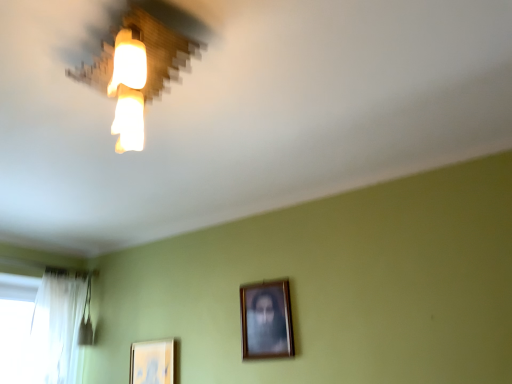
Question: Is wooden framed portrait at center, the 1th picture frame when ordered from right to left, in front of or behind matte white picture frame at lower left, arranged as the second picture frame when viewed from the right, in the image?

Choices:
 (A) behind
 (B) front

Answer: (B)

Question: Based on their positions, is wooden framed portrait at center, the first picture frame positioned from the front, located to the left or right of matte white picture frame at lower left, which appears as the first picture frame when viewed from the back?

Choices:
 (A) right
 (B) left

Answer: (A)

Question: Which object is the closest to the white sheer curtain at left?

Choices:
 (A) wooden framed portrait at center, the 2th picture frame viewed from the left
 (B) matte white picture frame at lower left, arranged as the second picture frame when viewed from the right
 (C) wooden lampshade at upper left

Answer: (B)

Question: Which object is positioned closest to the white sheer curtain at left?

Choices:
 (A) wooden lampshade at upper left
 (B) matte white picture frame at lower left, which is the second picture frame in front-to-back order
 (C) wooden framed portrait at center, the 1th picture frame when ordered from right to left

Answer: (B)